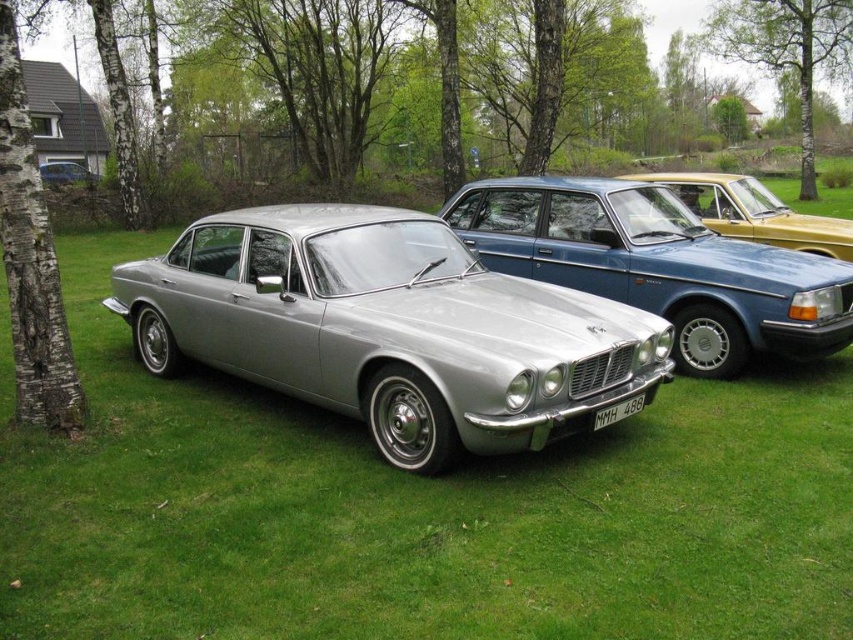
What is the spatial relationship between the silver Jaguar XJ at lower center and the bark textured tree at upper center?

The bark textured tree at upper center is positioned above the silver Jaguar XJ at lower center in the image.

You are a photographer trying to capture both the bark textured tree at left and the bark textured tree at upper center in a single frame. Which tree should you focus on to ensure both are visible without moving the camera?

The bark textured tree at left occupies less space than the bark textured tree at upper center, so focusing on the larger tree at upper center will help include both in the frame.

You are standing in a parking lot with a metallic gold car at center and a bark textured tree at left. Which object is positioned to the left of the other?

The bark textured tree at left is positioned to the left of the metallic gold car at center.